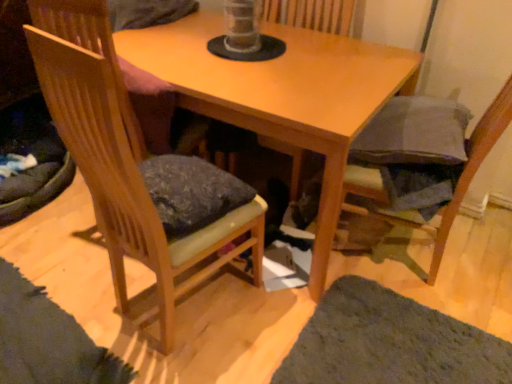
Locate an element on the screen. vacant space underneath green shaggy rug at lower right (from a real-world perspective) is located at coordinates (401, 349).